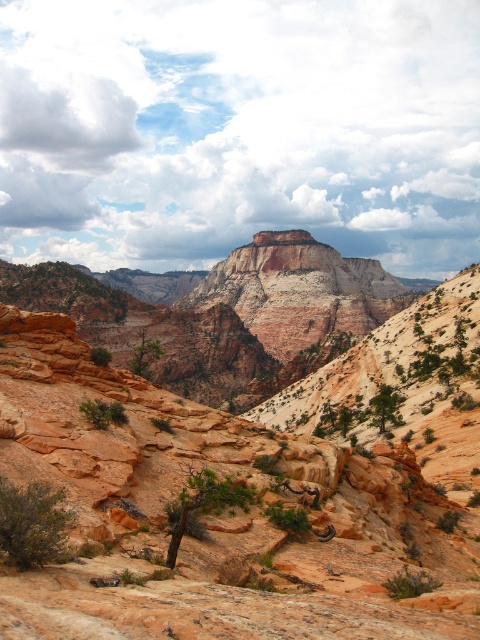
Is green matte tree at center-left bigger than green leafy tree at lower left?

Correct, green matte tree at center-left is larger in size than green leafy tree at lower left.

Is point (146, 355) more distant than point (108, 353)?

Yes, it is.

I want to click on green matte tree at center-left, so click(144, 355).

Which is in front, point (239, 500) or point (148, 358)?

Point (239, 500) is more forward.

Who is higher up, green matte tree at center or green matte tree at center-left?

green matte tree at center-left is above.

Is point (168, 506) positioned in front of point (144, 344)?

Yes, it is.

The image size is (480, 640). I want to click on green matte tree at center, so click(204, 500).

Does green leafy tree at center have a smaller size compared to green matte tree at center-left?

Correct, green leafy tree at center occupies less space than green matte tree at center-left.

Which is behind, point (396, 424) or point (133, 362)?

Point (133, 362)

Between point (379, 401) and point (140, 339), which one is positioned behind?

The point (140, 339) is more distant.

Where is `green leafy tree at center`? This screenshot has height=640, width=480. green leafy tree at center is located at coordinates (385, 406).